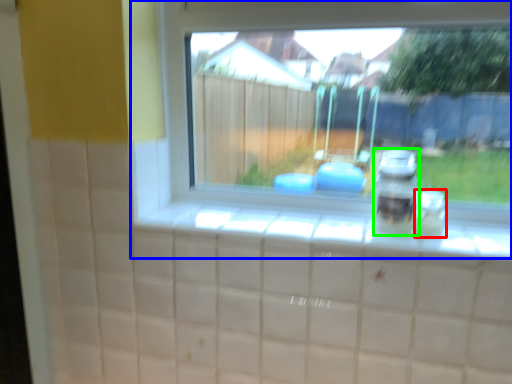
Question: Which is farther away from glass jar (highlighted by a red box)? window (highlighted by a blue box) or appliance (highlighted by a green box)?

Choices:
 (A) window
 (B) appliance

Answer: (A)